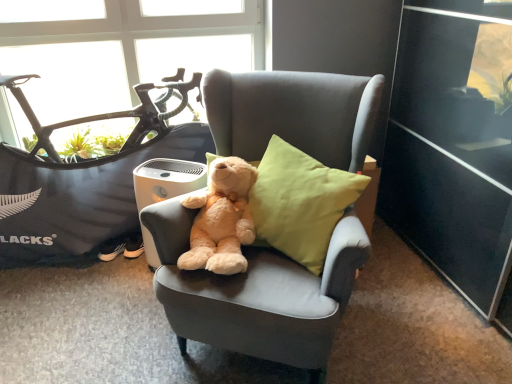
Find the location of a particular element. This screenshot has height=384, width=512. free space in front of black matte mountain bike at left is located at coordinates (89, 323).